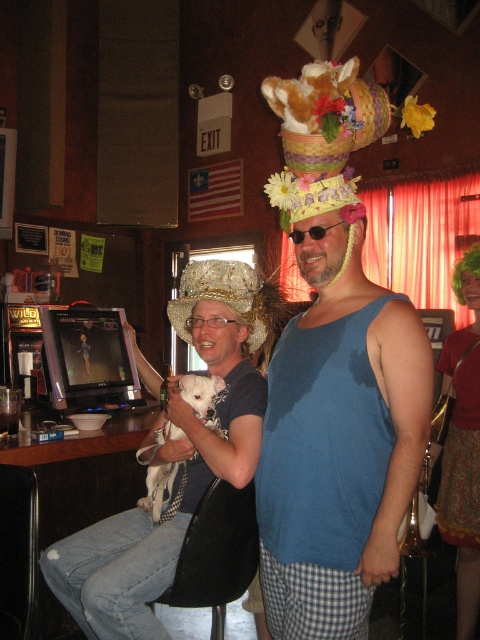
You are organizing a costume party and need to decide which item to place on a small shelf. The shelf can only hold items that are smaller than a certain size. Given the blue fabric tank top at center and the white fur dog at center, which item would you choose to place on the shelf?

The white fur dog at center is smaller than the blue fabric tank top at center, so you should choose the white fur dog at center to place on the shelf.

What is located at the central point of the image, which is marked as point (225, 298)?

The sparkly gold headdress at center is located at point (225, 298).